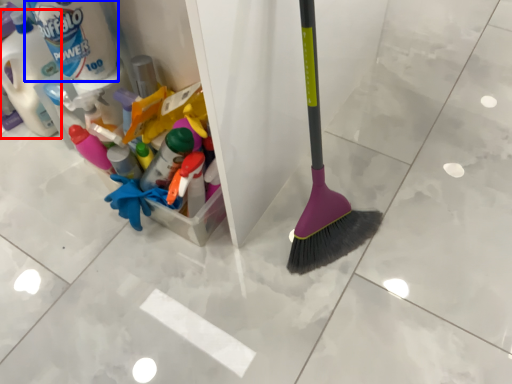
Question: Which object is closer to the camera taking this photo, bottle (highlighted by a red box) or cleaning product (highlighted by a blue box)?

Choices:
 (A) bottle
 (B) cleaning product

Answer: (B)